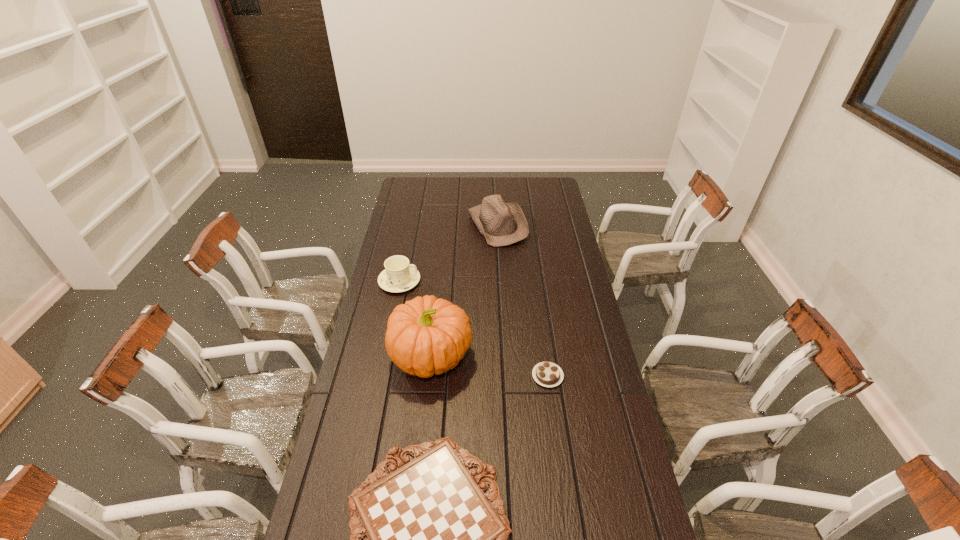
The image size is (960, 540). I want to click on object that is the fourth closest to the nearest object, so click(x=501, y=223).

This screenshot has width=960, height=540. What are the coordinates of `vacant space that satisfies the following two spatial constraints: 1. on the handle side of the third shortest object; 2. on the right side of the chocolate cake` in the screenshot? It's located at (380, 376).

At what (x,y) coordinates should I click in order to perform the action: click on vacant space that satisfies the following two spatial constraints: 1. on the back side of the chocolate cake; 2. on the handle side of the chinaware. Please return your answer as a coordinate pair (x, y). This screenshot has height=540, width=960. Looking at the image, I should click on (535, 281).

What are the coordinates of `free space that satisfies the following two spatial constraints: 1. on the handle side of the chinaware; 2. on the right side of the chocolate cake` in the screenshot? It's located at (380, 376).

Identify the location of blank area in the image that satisfies the following two spatial constraints: 1. on the surface of the fourth tallest object; 2. on the right side of the tallest object. The height and width of the screenshot is (540, 960). (430, 376).

This screenshot has width=960, height=540. What are the coordinates of `blank space that satisfies the following two spatial constraints: 1. on the back side of the chocolate cake; 2. on the handle side of the chinaware` in the screenshot? It's located at (535, 281).